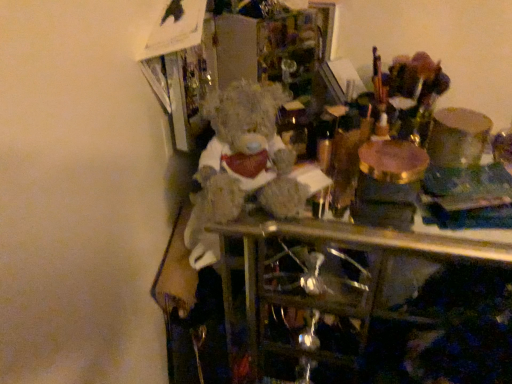
The width and height of the screenshot is (512, 384). Describe the element at coordinates (294, 127) in the screenshot. I see `translucent glass wine bottle at center` at that location.

You are a GUI agent. You are given a task and a screenshot of the screen. Output one action in this format:
    pyautogui.click(x=<x>, y=<y>)
    Task: Click on the translucent glass wine bottle at center
    
    Given the screenshot: What is the action you would take?
    pyautogui.click(x=294, y=127)

What are the coordinates of `fuzzy fabric teddy bear at center` in the screenshot? It's located at (241, 164).

Describe the element at coordinates (241, 164) in the screenshot. I see `fuzzy fabric teddy bear at center` at that location.

Where is `translucent glass wine bottle at center`? translucent glass wine bottle at center is located at coordinates (294, 127).

Looking at this image, which object is positioned more to the right, fuzzy fabric teddy bear at center or translucent glass wine bottle at center?

Positioned to the right is translucent glass wine bottle at center.

From the picture: Is fuzzy fabric teddy bear at center closer to the viewer compared to translucent glass wine bottle at center?

That is True.

Which is behind, point (278, 98) or point (305, 118)?

Point (305, 118)

From the image's perspective, is fuzzy fabric teddy bear at center located above or below translucent glass wine bottle at center?

From the image's perspective, fuzzy fabric teddy bear at center appears below translucent glass wine bottle at center.

From a real-world perspective, is fuzzy fabric teddy bear at center physically above translucent glass wine bottle at center?

Correct, in the physical world, fuzzy fabric teddy bear at center is higher than translucent glass wine bottle at center.

Can you confirm if fuzzy fabric teddy bear at center is thinner than translucent glass wine bottle at center?

No, fuzzy fabric teddy bear at center is not thinner than translucent glass wine bottle at center.

Considering the sizes of objects fuzzy fabric teddy bear at center and translucent glass wine bottle at center in the image provided, who is taller, fuzzy fabric teddy bear at center or translucent glass wine bottle at center?

fuzzy fabric teddy bear at center is taller.

From the picture: Is fuzzy fabric teddy bear at center bigger than translucent glass wine bottle at center?

Yes, fuzzy fabric teddy bear at center is bigger than translucent glass wine bottle at center.

Is translucent glass wine bottle at center located within fuzzy fabric teddy bear at center?

Definitely not — translucent glass wine bottle at center is not inside fuzzy fabric teddy bear at center.

Would you say fuzzy fabric teddy bear at center is a long distance from translucent glass wine bottle at center?

No.

Could you tell me if fuzzy fabric teddy bear at center is facing translucent glass wine bottle at center?

No, fuzzy fabric teddy bear at center is not turned towards translucent glass wine bottle at center.

Measure the distance from fuzzy fabric teddy bear at center to translucent glass wine bottle at center.

A distance of 5.14 inches exists between fuzzy fabric teddy bear at center and translucent glass wine bottle at center.

The height and width of the screenshot is (384, 512). Identify the location of wine bottle above the fuzzy fabric teddy bear at center (from the image's perspective). (294, 127).

Based on the photo, is translucent glass wine bottle at center to the right of fuzzy fabric teddy bear at center from the viewer's perspective?

Yes.

Between translucent glass wine bottle at center and fuzzy fabric teddy bear at center, which one is positioned behind?

translucent glass wine bottle at center is more distant.

Which is less distant, (303, 124) or (286, 154)?

Point (303, 124) is farther from the camera than point (286, 154).

From the image's perspective, which is above, translucent glass wine bottle at center or fuzzy fabric teddy bear at center?

translucent glass wine bottle at center is shown above in the image.

From a real-world perspective, is translucent glass wine bottle at center positioned under fuzzy fabric teddy bear at center based on gravity?

Yes.

Looking at this image, considering the relative sizes of translucent glass wine bottle at center and fuzzy fabric teddy bear at center in the image provided, is translucent glass wine bottle at center wider than fuzzy fabric teddy bear at center?

No.

From their relative heights in the image, would you say translucent glass wine bottle at center is taller or shorter than fuzzy fabric teddy bear at center?

In the image, translucent glass wine bottle at center appears to be shorter than fuzzy fabric teddy bear at center.

Is translucent glass wine bottle at center smaller than fuzzy fabric teddy bear at center?

A: Correct, translucent glass wine bottle at center occupies less space than fuzzy fabric teddy bear at center.

Could fuzzy fabric teddy bear at center be considered to be inside translucent glass wine bottle at center?

No, fuzzy fabric teddy bear at center is located outside of translucent glass wine bottle at center.

Is translucent glass wine bottle at center not close to fuzzy fabric teddy bear at center?

translucent glass wine bottle at center is actually quite close to fuzzy fabric teddy bear at center.

Is translucent glass wine bottle at center looking in the opposite direction of fuzzy fabric teddy bear at center?

translucent glass wine bottle at center is not turned away from fuzzy fabric teddy bear at center.

At what (x,y) coordinates should I click in order to perform the action: click on wine bottle on the right of fuzzy fabric teddy bear at center. Please return your answer as a coordinate pair (x, y). Looking at the image, I should click on (294, 127).

Locate an element on the screen. Image resolution: width=512 pixels, height=384 pixels. teddy bear positioned vertically above the translucent glass wine bottle at center (from a real-world perspective) is located at coordinates (241, 164).

Locate an element on the screen. This screenshot has height=384, width=512. teddy bear below the translucent glass wine bottle at center (from the image's perspective) is located at coordinates (241, 164).